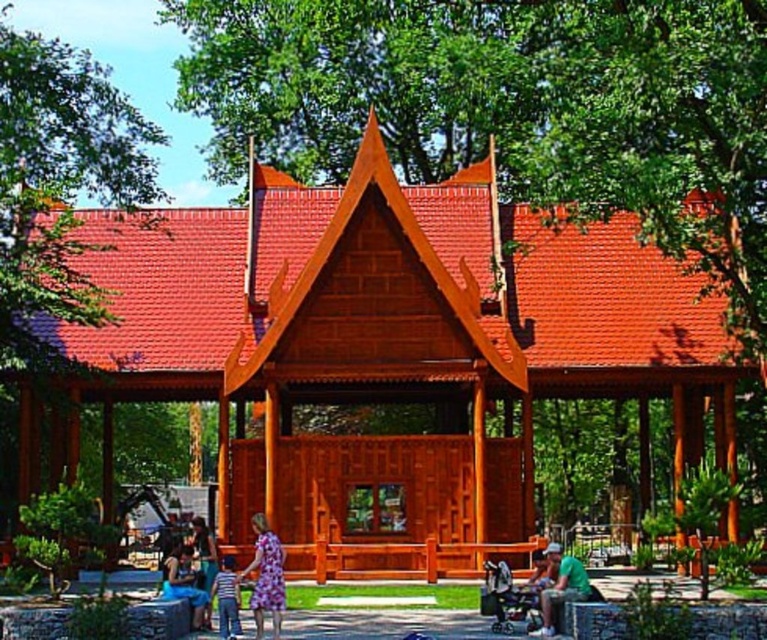
You are a photographer positioned at the entrance of the pavilion. You want to capture a photo that includes both the floral dress at center and the green matte shirt at lower right. Which direction should you move to ensure both subjects are in frame?

To include both the floral dress at center and the green matte shirt at lower right in the photo, you should move to the left since the floral dress at center is positioned to the left of the green matte shirt at lower right.

From the picture: You are planning to take a photo of the shiny wood gazebo at center and the green matte shirt at lower right. Which object should you focus on first if you want to include both in the frame without moving the camera?

The shiny wood gazebo at center is bigger than the green matte shirt at lower right, so you should focus on the shiny wood gazebo at center first to ensure it fits properly in the frame before adjusting for the smaller green matte shirt at lower right.